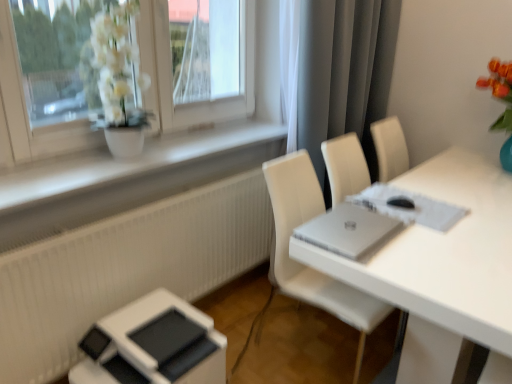
Question: From the image's perspective, relative to gray matte curtain at upper right, is white glossy table at center above or below?

Choices:
 (A) above
 (B) below

Answer: (B)

Question: Which is correct: white glossy table at center is inside gray matte curtain at upper right, or outside of it?

Choices:
 (A) outside
 (B) inside

Answer: (A)

Question: Which object is the farthest from the white glossy table at center?

Choices:
 (A) silver metallic laptop at center
 (B) white leather chair at right
 (C) gray matte curtain at upper right
 (D) white matte window sill at upper left

Answer: (D)

Question: Considering the real-world distances, which object is farthest from the white leather chair at right?

Choices:
 (A) silver metallic laptop at center
 (B) white matte window sill at upper left
 (C) gray matte curtain at upper right
 (D) white glossy table at center

Answer: (B)